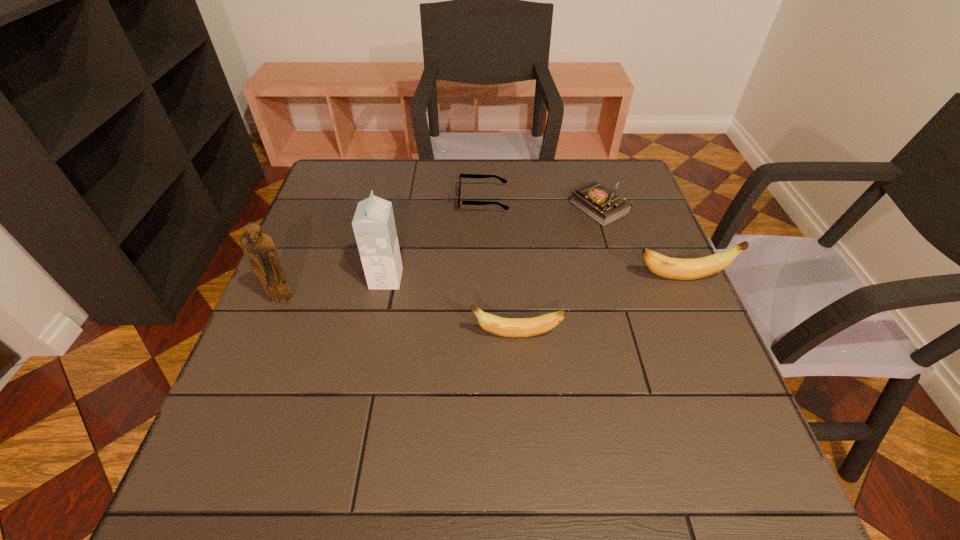
Locate an element on the screen. This screenshot has width=960, height=540. vacant space located at the stem of the nearest object is located at coordinates (443, 335).

At what (x,y) coordinates should I click in order to perform the action: click on vacant space located at the stem of the nearest object. Please return your answer as a coordinate pair (x, y). This screenshot has width=960, height=540. Looking at the image, I should click on 385,335.

Locate an element on the screen. The width and height of the screenshot is (960, 540). free spot located on the arms of the spectacles is located at coordinates (360, 200).

This screenshot has width=960, height=540. In order to click on free spot located on the arms of the spectacles in this screenshot , I will do `click(322, 200)`.

Where is `vacant space located on the arms of the spectacles`? This screenshot has width=960, height=540. vacant space located on the arms of the spectacles is located at coordinates (393, 200).

Find the location of a particular element. vacant space situated on the left of the diary is located at coordinates (477, 208).

Where is `free region located 0.180m on the front label of the carton`? The width and height of the screenshot is (960, 540). free region located 0.180m on the front label of the carton is located at coordinates (478, 279).

Where is `vacant space located 0.080m on the front-facing side of the fifth farthest object`? This screenshot has height=540, width=960. vacant space located 0.080m on the front-facing side of the fifth farthest object is located at coordinates (270, 335).

The height and width of the screenshot is (540, 960). I want to click on spectacles that is at the far edge, so click(x=504, y=181).

The width and height of the screenshot is (960, 540). I want to click on diary at the far edge, so click(x=602, y=205).